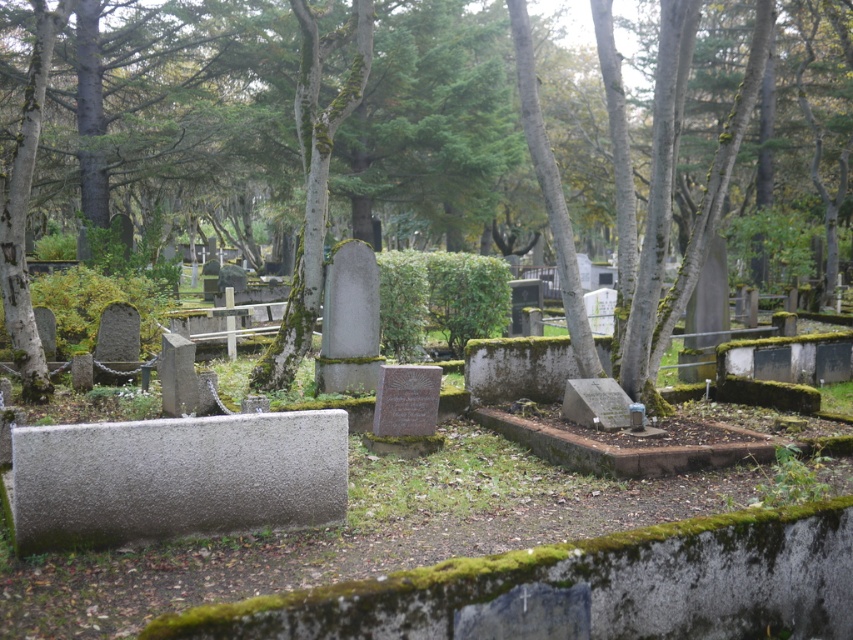
Question: Is granite tombstone at center above green mossy tree at center?

Choices:
 (A) yes
 (B) no

Answer: (B)

Question: Can you confirm if granite tombstone at center is positioned to the left of green mossy tree at center?

Choices:
 (A) no
 (B) yes

Answer: (B)

Question: Which point appears farthest from the camera in this image?

Choices:
 (A) (643, 310)
 (B) (231, 596)

Answer: (A)

Question: Does granite tombstone at center appear under green mossy tree at center?

Choices:
 (A) yes
 (B) no

Answer: (A)

Question: Among these objects, which one is farthest from the camera?

Choices:
 (A) green mossy tree at center
 (B) granite tombstone at center

Answer: (A)